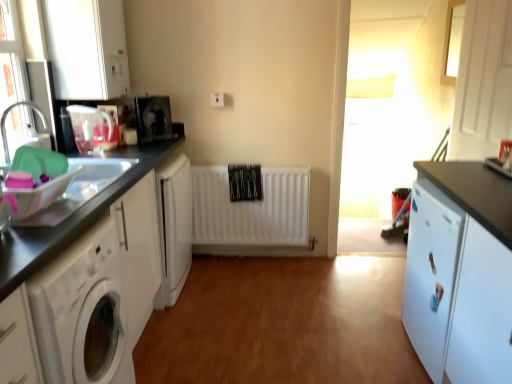
Question: From the image's perspective, is translucent plastic sink at left located above or below translucent plastic kettle at left, the 2th appliance when ordered from front to back?

Choices:
 (A) above
 (B) below

Answer: (B)

Question: From their relative heights in the image, would you say translucent plastic sink at left is taller or shorter than translucent plastic kettle at left, placed as the 2th appliance when sorted from back to front?

Choices:
 (A) tall
 (B) short

Answer: (B)

Question: Based on their relative distances, which object is nearer to the white matte cabinet at upper left, which is the 1th cabinetry in left-to-right order?

Choices:
 (A) translucent plastic jug at left, the third appliance in the back-to-front sequence
 (B) white glossy washing machine at lower left
 (C) translucent plastic sink at left
 (D) brushed metal faucet at left
 (E) black plastic microwave at upper left, which ranks as the third appliance in front-to-back order

Answer: (A)

Question: Which object is positioned farthest from the white matte cabinet at upper left, the 3th cabinetry when ordered from right to left?

Choices:
 (A) translucent plastic jug at left, placed as the 1th appliance when sorted from front to back
 (B) white matte washing machine at left
 (C) translucent plastic kettle at left, the 2th appliance when ordered from front to back
 (D) brushed metal faucet at left
 (E) translucent plastic sink at left

Answer: (B)